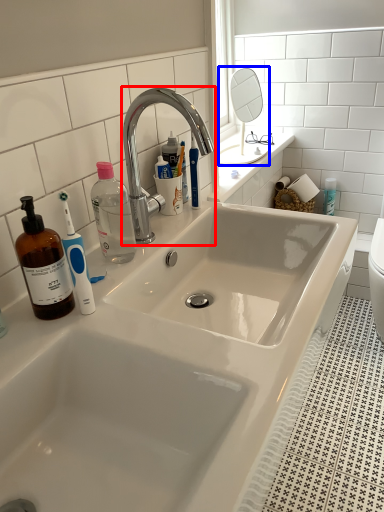
Question: Which object is further to the camera taking this photo, tap (highlighted by a red box) or mirror (highlighted by a blue box)?

Choices:
 (A) tap
 (B) mirror

Answer: (B)